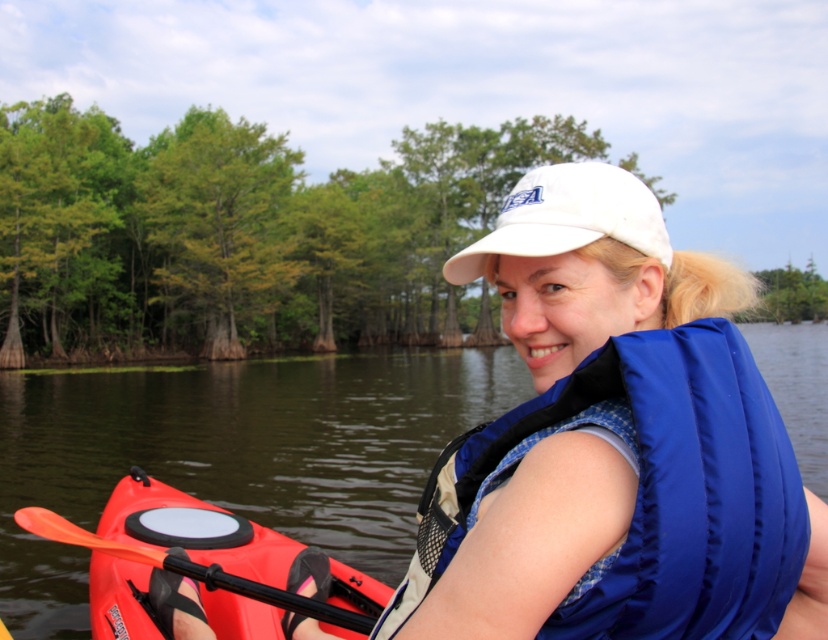
Between blue fabric life jacket at center and orange plastic paddle at lower left, which one has less height?

orange plastic paddle at lower left

Does blue fabric life jacket at center have a lesser height compared to orange plastic paddle at lower left?

In fact, blue fabric life jacket at center may be taller than orange plastic paddle at lower left.

What are the coordinates of `blue fabric life jacket at center` in the screenshot? It's located at (650, 492).

Is blue fabric life jacket at center above white fabric baseball cap at center?

Actually, blue fabric life jacket at center is below white fabric baseball cap at center.

Between blue fabric life jacket at center and white fabric baseball cap at center, which one has less height?

With less height is white fabric baseball cap at center.

The width and height of the screenshot is (828, 640). What do you see at coordinates (650, 492) in the screenshot?
I see `blue fabric life jacket at center` at bounding box center [650, 492].

This screenshot has width=828, height=640. What are the coordinates of `blue fabric life jacket at center` in the screenshot? It's located at (650, 492).

Does white fabric baseball cap at center have a lesser height compared to orange plastic paddle at lower left?

No.

Consider the image. Who is more forward, (x=605, y=182) or (x=78, y=531)?

Point (x=605, y=182) is more forward.

Does point (506, 198) come in front of point (53, 516)?

No.

The image size is (828, 640). I want to click on white fabric baseball cap at center, so pyautogui.click(x=567, y=218).